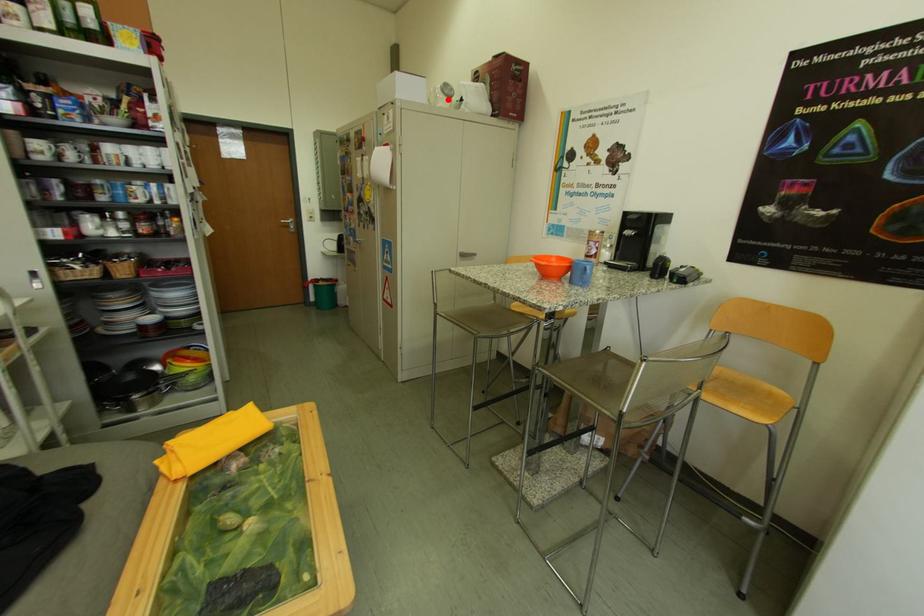
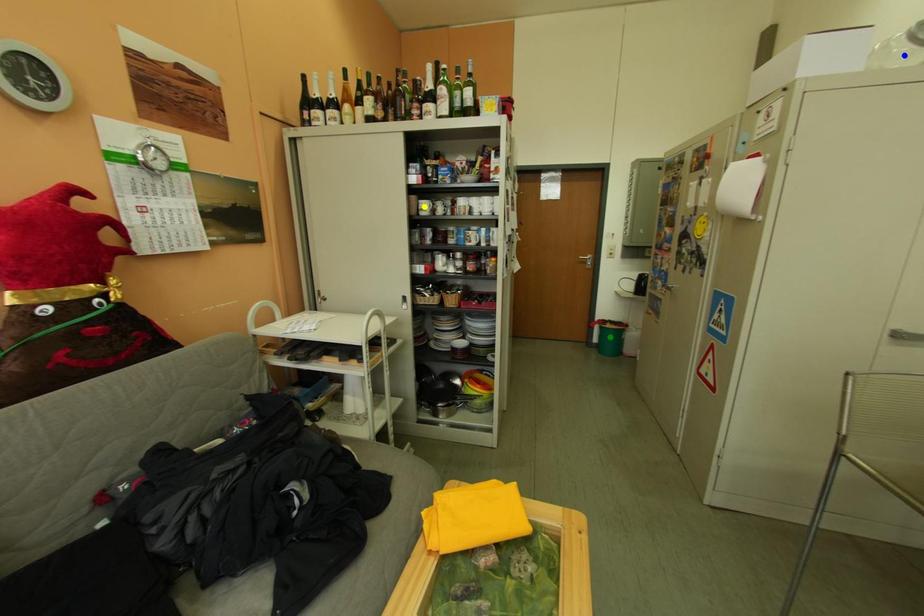
Question: I am providing you with two images of the same scene from different viewpoints. A red point is marked on the first image. You are given multiple points on the second image. Which point in image 2 is actually the same real-world point as the red point in image 1?

Choices:
 (A) blue point
 (B) green point
 (C) yellow point

Answer: (A)